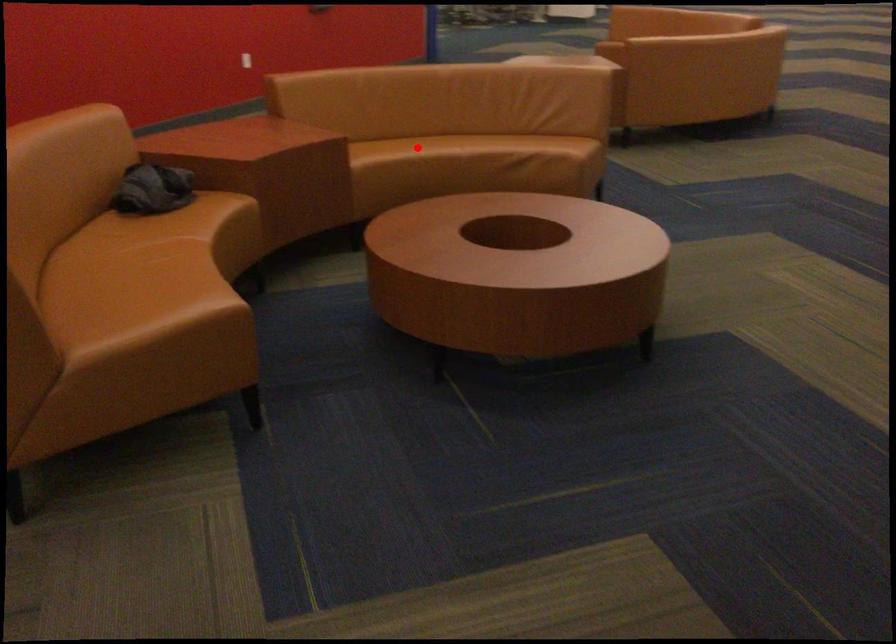
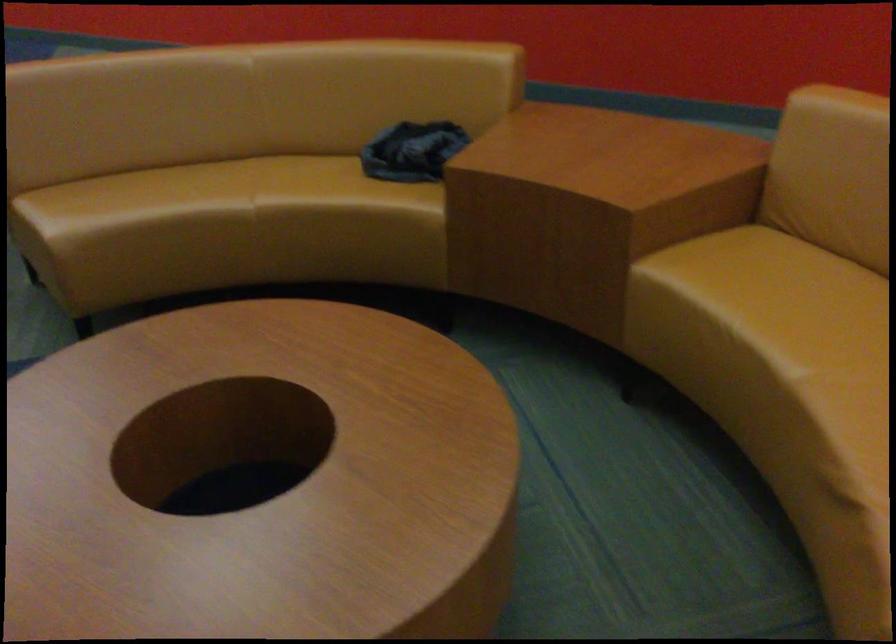
Question: I am providing you with two images of the same scene from different viewpoints. Given a red point in image1, look at the same physical point in image2. Is it:

Choices:
 (A) Closer to the viewpoint
 (B) Farther from the viewpoint

Answer: (A)